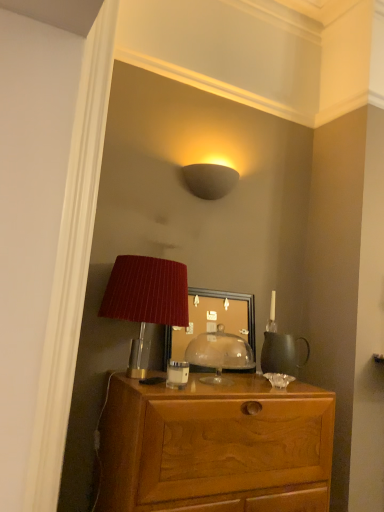
Question: Considering the positions of matte red lampshade at center and matte glass mirror at center in the image, is matte red lampshade at center taller or shorter than matte glass mirror at center?

Choices:
 (A) short
 (B) tall

Answer: (A)

Question: Would you say matte red lampshade at center is inside or outside matte glass mirror at center?

Choices:
 (A) inside
 (B) outside

Answer: (B)

Question: Which object is positioned farthest from the matte gray wall sconce at upper center, the first lamp in the back-to-front sequence?

Choices:
 (A) white glossy coffee cup at center
 (B) matte red lampshade at center
 (C) matte glass mirror at center
 (D) wooden desk at center
 (E) matte red lampshade at center, the first lamp ordered from the bottom

Answer: (D)

Question: Which object is the closest to the matte glass mirror at center?

Choices:
 (A) matte red lampshade at center
 (B) matte red lampshade at center, which is the second lamp from top to bottom
 (C) wooden desk at center
 (D) matte gray wall sconce at upper center, positioned as the 2th lamp in front-to-back order
 (E) white glossy coffee cup at center

Answer: (A)